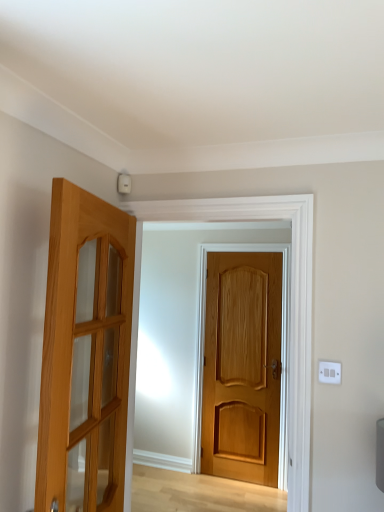
This screenshot has width=384, height=512. In order to click on vacant space in front of light brown wooden door at center, acting as the 2th door starting from the left in this screenshot , I will do `click(236, 496)`.